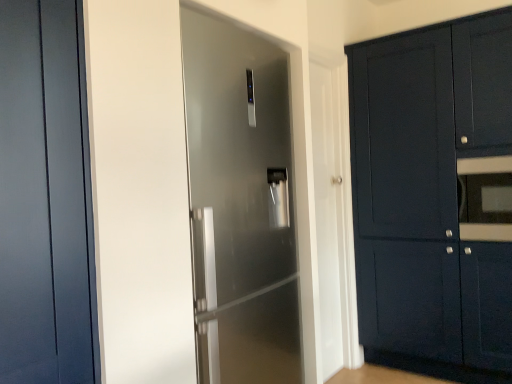
Question: Would you say matte dark blue door at left, the second door when ordered from back to front, is a long distance from satin silver refrigerator at center, acting as the second door starting from the front?

Choices:
 (A) yes
 (B) no

Answer: (B)

Question: Could you tell me if matte dark blue door at left, the first door when ordered from front to back, is facing satin silver refrigerator at center, which is the first door in back-to-front order?

Choices:
 (A) no
 (B) yes

Answer: (A)

Question: Does matte dark blue door at left, the first door when ordered from front to back, have a lesser height compared to satin silver refrigerator at center, the 1th door from the right?

Choices:
 (A) no
 (B) yes

Answer: (B)

Question: From the image's perspective, is matte dark blue door at left, the 1th door from the left, below satin silver refrigerator at center, the 1th door from the right?

Choices:
 (A) no
 (B) yes

Answer: (A)

Question: Is matte dark blue door at left, which is counted as the 2th door, starting from the right, positioned before satin silver refrigerator at center, which is the first door in back-to-front order?

Choices:
 (A) no
 (B) yes

Answer: (B)

Question: Considering the positions of matte black oven at right and satin silver refrigerator at center, which is the first door in back-to-front order, in the image, is matte black oven at right taller or shorter than satin silver refrigerator at center, which is the first door in back-to-front order,?

Choices:
 (A) short
 (B) tall

Answer: (A)

Question: Visually, is matte black oven at right positioned to the left or to the right of satin silver refrigerator at center, which appears as the 2th door when viewed from the left?

Choices:
 (A) left
 (B) right

Answer: (B)

Question: Is matte black oven at right bigger or smaller than satin silver refrigerator at center, acting as the second door starting from the front?

Choices:
 (A) small
 (B) big

Answer: (A)

Question: From a real-world perspective, is matte black oven at right positioned above or below satin silver refrigerator at center, which appears as the 2th door when viewed from the left?

Choices:
 (A) below
 (B) above

Answer: (B)

Question: In the image, is satin silver refrigerator at center, which is the first door in back-to-front order, positioned in front of or behind matte dark blue cabinet at right?

Choices:
 (A) behind
 (B) front

Answer: (B)

Question: Do you think satin silver refrigerator at center, the 1th door from the right, is within matte dark blue cabinet at right, or outside of it?

Choices:
 (A) inside
 (B) outside

Answer: (B)

Question: Considering the positions of satin silver refrigerator at center, which appears as the 2th door when viewed from the left, and matte dark blue cabinet at right in the image, is satin silver refrigerator at center, which appears as the 2th door when viewed from the left, wider or thinner than matte dark blue cabinet at right?

Choices:
 (A) thin
 (B) wide

Answer: (A)

Question: In the image, is satin silver refrigerator at center, the 1th door from the right, on the left side or the right side of matte dark blue cabinet at right?

Choices:
 (A) left
 (B) right

Answer: (A)

Question: From the image's perspective, relative to matte dark blue door at left, the second door when ordered from back to front, is satin silver refrigerator at center, the 1th door from the right, above or below?

Choices:
 (A) above
 (B) below

Answer: (B)

Question: Choose the correct answer: Is satin silver refrigerator at center, which appears as the 2th door when viewed from the left, inside matte dark blue door at left, which is counted as the 2th door, starting from the right, or outside it?

Choices:
 (A) inside
 (B) outside

Answer: (B)